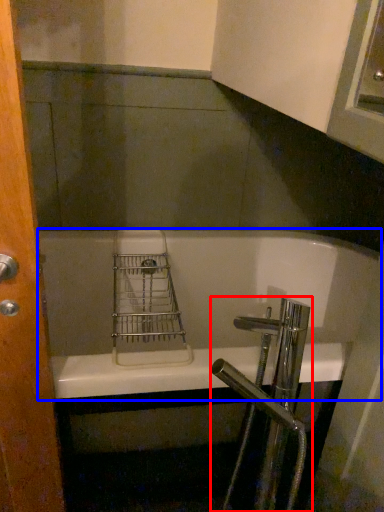
Question: Which object appears closest to the camera in this image, tap (highlighted by a red box) or bathtub (highlighted by a blue box)?

Choices:
 (A) tap
 (B) bathtub

Answer: (A)